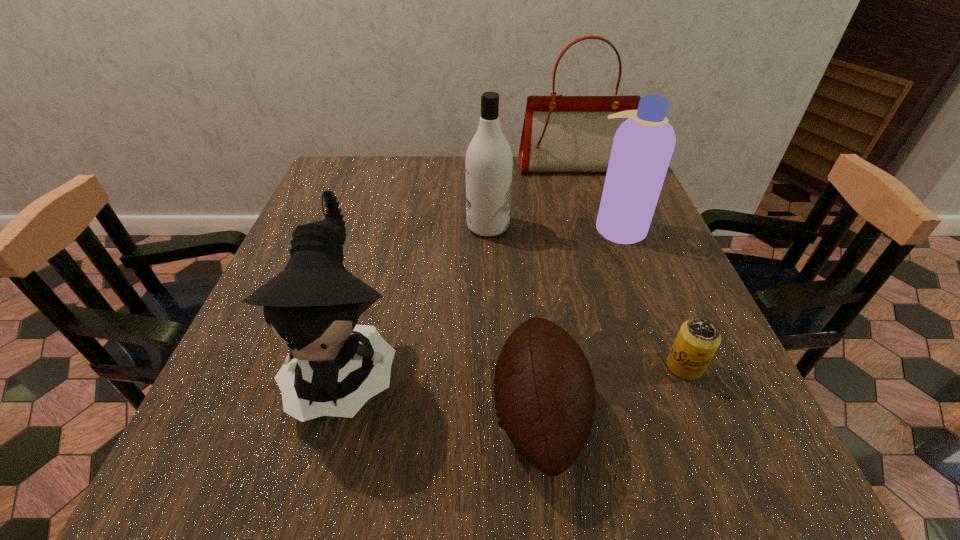
You are a GUI agent. You are given a task and a screenshot of the screen. Output one action in this format:
    pyautogui.click(x=<x>, y=<y>)
    Task: Click on the handbag
    The image size is (960, 540).
    Given the screenshot: What is the action you would take?
    pyautogui.click(x=561, y=134)

The image size is (960, 540). In order to click on the left shampoo in this screenshot , I will do `click(488, 162)`.

The image size is (960, 540). I want to click on the right shampoo, so click(643, 145).

Locate an element on the screen. This screenshot has height=540, width=960. doll is located at coordinates (313, 305).

Identify the location of the fifth tallest object. Image resolution: width=960 pixels, height=540 pixels. (545, 398).

This screenshot has width=960, height=540. I want to click on the shortest object, so click(698, 339).

This screenshot has width=960, height=540. Find the location of `vacant space located 0.110m on the left of the handbag`. vacant space located 0.110m on the left of the handbag is located at coordinates (482, 167).

I want to click on vacant region located 0.230m on the front-facing side of the left shampoo, so click(x=372, y=226).

Locate an element on the screen. The image size is (960, 540). free space located 0.250m on the front-facing side of the left shampoo is located at coordinates (364, 226).

At what (x,y) coordinates should I click in order to perform the action: click on free spot located on the front-facing side of the left shampoo. Please return your answer as a coordinate pair (x, y). The image size is (960, 540). Looking at the image, I should click on tap(315, 226).